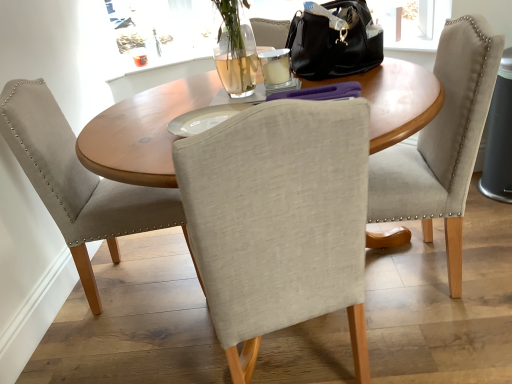
At what (x,y) coordinates should I click in order to perform the action: click on vacant space that is to the left of wooden table at center. Please return your answer as a coordinate pair (x, y). The width and height of the screenshot is (512, 384). Looking at the image, I should click on (158, 346).